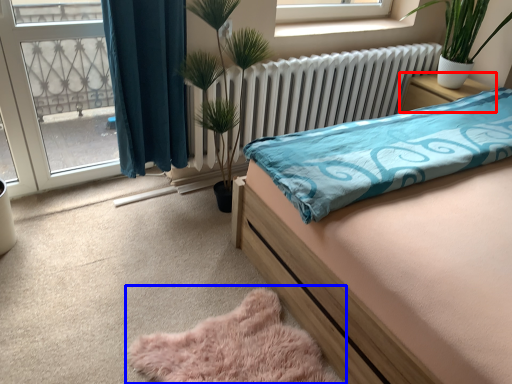
Question: Which of the following is the closest to the observer, nightstand (highlighted by a red box) or plain (highlighted by a blue box)?

Choices:
 (A) nightstand
 (B) plain

Answer: (B)